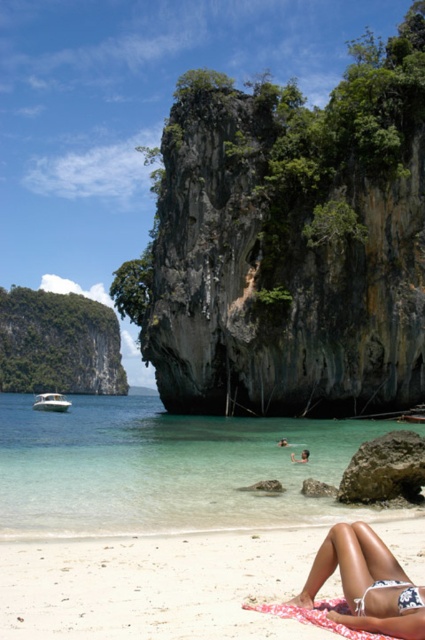
Which is above, clear water at center or white sandy beach at lower center?

Positioned higher is white sandy beach at lower center.

Looking at this image, which of these two, clear water at center or white sandy beach at lower center, stands shorter?

white sandy beach at lower center

Image resolution: width=425 pixels, height=640 pixels. What are the coordinates of `clear water at center` in the screenshot? It's located at (164, 467).

Who is taller, white sandy beach at lower center or white fabric bikini top at lower right?

Standing taller between the two is white sandy beach at lower center.

Who is more distant from viewer, [30,588] or [402,586]?

The point [30,588] is behind.

This screenshot has height=640, width=425. Identify the location of white sandy beach at lower center. (155, 586).

Describe the element at coordinates (155, 586) in the screenshot. I see `white sandy beach at lower center` at that location.

Can you confirm if white sandy beach at lower center is shorter than white glossy boat at left?

Yes, white sandy beach at lower center is shorter than white glossy boat at left.

Who is more distant from viewer, (90, 604) or (48, 406)?

The point (48, 406) is behind.

Image resolution: width=425 pixels, height=640 pixels. What are the coordinates of `white sandy beach at lower center` in the screenshot? It's located at (155, 586).